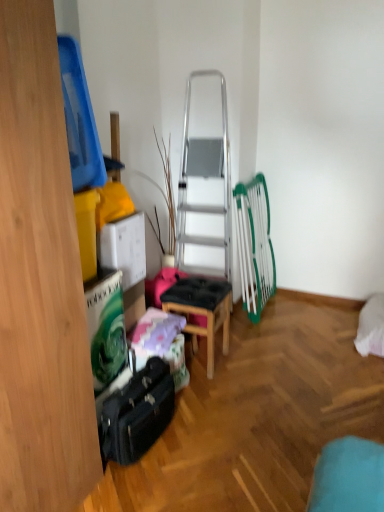
This screenshot has height=512, width=384. What do you see at coordinates (137, 414) in the screenshot?
I see `black leather suitcase at lower left` at bounding box center [137, 414].

This screenshot has width=384, height=512. Identify the location of black leather suitcase at lower left. (137, 414).

The width and height of the screenshot is (384, 512). Find the location of `wooden stool at center`. wooden stool at center is located at coordinates (202, 310).

Image resolution: width=384 pixels, height=512 pixels. Describe the element at coordinates (202, 310) in the screenshot. I see `wooden stool at center` at that location.

In order to face wooden stool at center, should I rotate leftwards or rightwards?

You should look right and rotate roughly 0.537 degrees.

Locate an element on the screen. The image size is (384, 512). black leather suitcase at lower left is located at coordinates (137, 414).

Consider the image. Does wooden stool at center appear on the right side of black leather suitcase at lower left?

Yes.

Is the depth of wooden stool at center greater than that of black leather suitcase at lower left?

Yes, wooden stool at center is further from the camera.

Considering the points (170, 294) and (109, 396), which point is behind, point (170, 294) or point (109, 396)?

Point (170, 294)

From the image's perspective, is wooden stool at center beneath black leather suitcase at lower left?

Incorrect, from the image's perspective, wooden stool at center is higher than black leather suitcase at lower left.

From a real-world perspective, which is physically above, wooden stool at center or black leather suitcase at lower left?

From a 3D spatial view, wooden stool at center is above.

Which of these two, wooden stool at center or black leather suitcase at lower left, is wider?

wooden stool at center is wider.

Is wooden stool at center taller than black leather suitcase at lower left?

Correct, wooden stool at center is much taller as black leather suitcase at lower left.

Is wooden stool at center smaller than black leather suitcase at lower left?

No.

Choose the correct answer: Is wooden stool at center inside black leather suitcase at lower left or outside it?

wooden stool at center is spatially situated outside black leather suitcase at lower left.

Is wooden stool at center positioned far away from black leather suitcase at lower left?

They are positioned close to each other.

Does wooden stool at center turn towards black leather suitcase at lower left?

No, wooden stool at center is not aimed at black leather suitcase at lower left.

Measure the distance between wooden stool at center and black leather suitcase at lower left.

The distance of wooden stool at center from black leather suitcase at lower left is 23.85 inches.

The image size is (384, 512). I want to click on stool above the black leather suitcase at lower left (from a real-world perspective), so click(202, 310).

From the picture: Is black leather suitcase at lower left at the right side of wooden stool at center?

In fact, black leather suitcase at lower left is to the left of wooden stool at center.

Which object is closer to the camera, black leather suitcase at lower left or wooden stool at center?

black leather suitcase at lower left is in front.

Which point is more forward, (142, 436) or (193, 339)?

The point (142, 436) is closer.

From the image's perspective, would you say black leather suitcase at lower left is shown under wooden stool at center?

Yes, from the image's perspective, black leather suitcase at lower left is below wooden stool at center.

From a real-world perspective, is black leather suitcase at lower left located beneath wooden stool at center?

Yes, from a real-world perspective, black leather suitcase at lower left is below wooden stool at center.

Is black leather suitcase at lower left wider or thinner than wooden stool at center?

black leather suitcase at lower left is thinner than wooden stool at center.

Is black leather suitcase at lower left taller than wooden stool at center?

No.

Can you confirm if black leather suitcase at lower left is bigger than wooden stool at center?

Incorrect, black leather suitcase at lower left is not larger than wooden stool at center.

Is black leather suitcase at lower left surrounding wooden stool at center?

No, wooden stool at center is not a part of black leather suitcase at lower left.

Is black leather suitcase at lower left far from wooden stool at center?

No.

Is black leather suitcase at lower left turned away from wooden stool at center?

No, wooden stool at center is not at the back of black leather suitcase at lower left.

Looking at this image, can you tell me how much black leather suitcase at lower left and wooden stool at center differ in facing direction?

3.85 degrees.

Locate an element on the screen. This screenshot has width=384, height=512. stool located above the black leather suitcase at lower left (from a real-world perspective) is located at coordinates (202, 310).

Locate an element on the screen. The height and width of the screenshot is (512, 384). stool lying above the black leather suitcase at lower left (from the image's perspective) is located at coordinates (202, 310).

At what (x,y) coordinates should I click in order to perform the action: click on luggage that appears on the left of wooden stool at center. Please return your answer as a coordinate pair (x, y). Looking at the image, I should click on (137, 414).